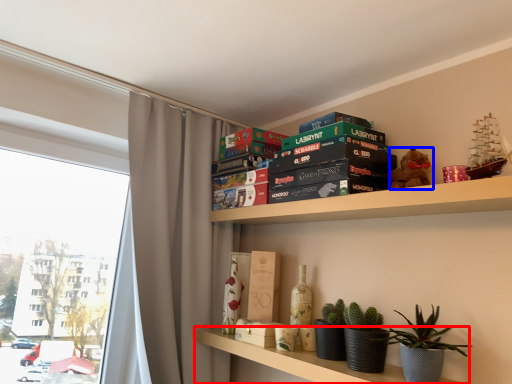
Question: Which point is closer to the camera, shelf (highlighted by a red box) or toy (highlighted by a blue box)?

Choices:
 (A) shelf
 (B) toy

Answer: (A)